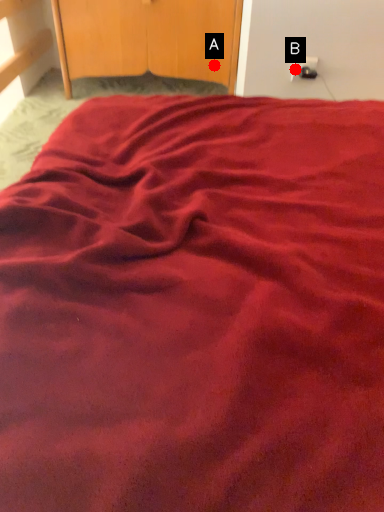
Question: Two points are circled on the image, labeled by A and B beside each circle. Which point is closer to the camera?

Choices:
 (A) A is closer
 (B) B is closer

Answer: (B)